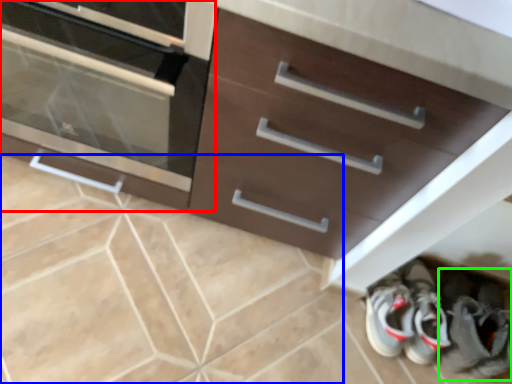
Question: Which object is positioned closest to chest of drawers (highlighted by a red box)? Select from ceramic tile (highlighted by a blue box) and footwear (highlighted by a green box).

Choices:
 (A) ceramic tile
 (B) footwear

Answer: (A)